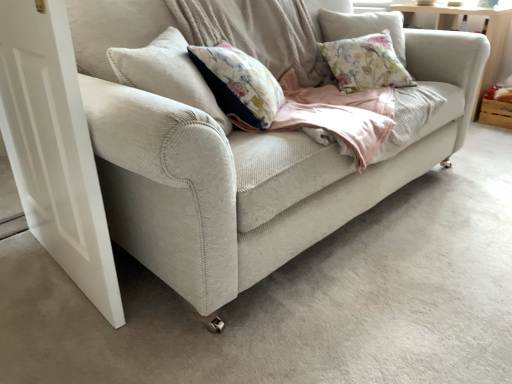
Identify the location of white matte door at left. tap(54, 148).

Image resolution: width=512 pixels, height=384 pixels. What are the coordinates of `screen door that is on the left side of wooden crate at right` in the screenshot? It's located at (54, 148).

Is wooden crate at right turned away from white matte door at left?

No.

From the picture: How different are the orientations of wooden crate at right and white matte door at left in degrees?

There is a 5.6-degree angle between the facing directions of wooden crate at right and white matte door at left.

Does light beige fabric couch at center have a greater height compared to white matte door at left?

No, light beige fabric couch at center is not taller than white matte door at left.

Where is `screen door behind the light beige fabric couch at center`? screen door behind the light beige fabric couch at center is located at coordinates (54, 148).

From a real-world perspective, who is located higher, light beige fabric couch at center or white matte door at left?

From a 3D spatial view, light beige fabric couch at center is above.

How much distance is there between white matte door at left and light beige fabric couch at center?

white matte door at left is 14.82 inches from light beige fabric couch at center.

Is white matte door at left taller than light beige fabric couch at center?

Yes.

The height and width of the screenshot is (384, 512). I want to click on studio couch that is on the right side of white matte door at left, so click(237, 161).

From the image's perspective, would you say white matte door at left is shown under light beige fabric couch at center?

Yes, from the image's perspective, white matte door at left is beneath light beige fabric couch at center.

From a real-world perspective, does light beige fabric couch at center stand above wooden crate at right?

Yes, from a real-world perspective, light beige fabric couch at center is on top of wooden crate at right.

Can wooden crate at right be found inside light beige fabric couch at center?

No.

Looking at this image, relative to wooden crate at right, is light beige fabric couch at center in front or behind?

Clearly, light beige fabric couch at center is in front of wooden crate at right.

Consider the image. Considering the relative sizes of light beige fabric couch at center and wooden crate at right in the image provided, is light beige fabric couch at center shorter than wooden crate at right?

In fact, light beige fabric couch at center may be taller than wooden crate at right.

Does wooden crate at right have a greater height compared to light beige fabric couch at center?

Incorrect, the height of wooden crate at right is not larger of that of light beige fabric couch at center.

Is wooden crate at right at the left side of light beige fabric couch at center?

No.

Considering their positions, is wooden crate at right located in front of or behind light beige fabric couch at center?

Visually, wooden crate at right is located behind light beige fabric couch at center.

Can you tell me how much wooden crate at right and light beige fabric couch at center differ in facing direction?

The angular difference between wooden crate at right and light beige fabric couch at center is 87.9 degrees.

In the scene shown: Is white matte door at left shorter than wooden crate at right?

No, white matte door at left is not shorter than wooden crate at right.

Would you say white matte door at left is outside wooden crate at right?

Yes, white matte door at left is outside of wooden crate at right.

Between point (42, 104) and point (482, 113), which one is positioned in front?

Positioned in front is point (42, 104).

Is white matte door at left to the left of wooden crate at right from the viewer's perspective?

Correct, you'll find white matte door at left to the left of wooden crate at right.

I want to click on drawer below the white matte door at left (from a real-world perspective), so click(x=496, y=113).

Locate an element on the screen. The image size is (512, 384). screen door behind the light beige fabric couch at center is located at coordinates (54, 148).

Considering their positions, is light beige fabric couch at center positioned further to white matte door at left than wooden crate at right?

wooden crate at right is positioned further to the anchor white matte door at left.

From the image, which object appears to be nearer to light beige fabric couch at center, wooden crate at right or white matte door at left?

The object closer to light beige fabric couch at center is white matte door at left.

Based on their spatial positions, is light beige fabric couch at center or white matte door at left closer to wooden crate at right?

The object closer to wooden crate at right is light beige fabric couch at center.

When comparing their distances from white matte door at left, does wooden crate at right or light beige fabric couch at center seem further?

The object further to white matte door at left is wooden crate at right.

When comparing their distances from light beige fabric couch at center, does white matte door at left or wooden crate at right seem closer?

The object closer to light beige fabric couch at center is white matte door at left.

From the image, which object appears to be nearer to wooden crate at right, white matte door at left or light beige fabric couch at center?

light beige fabric couch at center.

At what (x,y) coordinates should I click in order to perform the action: click on studio couch between white matte door at left and wooden crate at right from left to right. Please return your answer as a coordinate pair (x, y). Looking at the image, I should click on click(x=237, y=161).